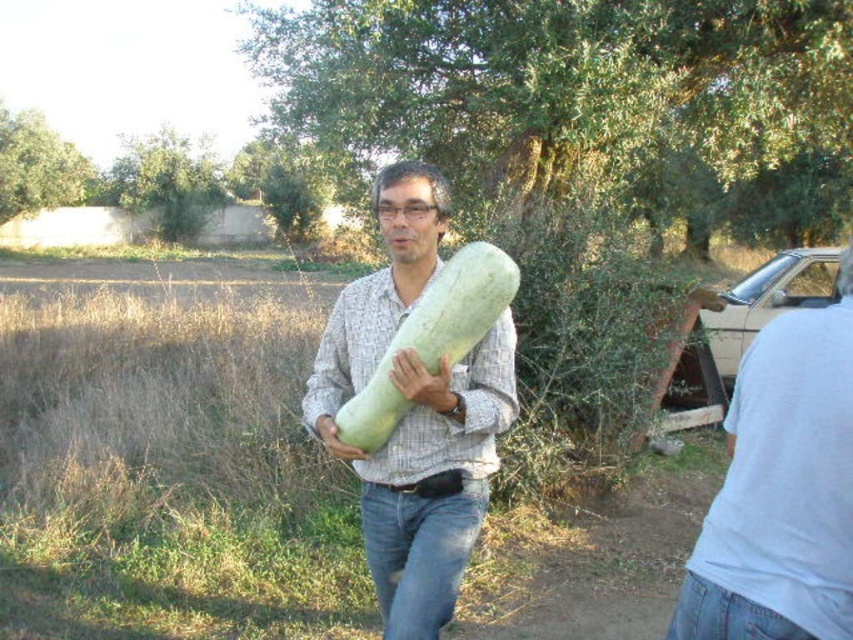
Which is behind, point (809, 292) or point (401, 387)?

The point (809, 292) is more distant.

Where is `beige metallic car at right`? This screenshot has height=640, width=853. beige metallic car at right is located at coordinates [769, 300].

Is point (751, 336) positioned after point (398, 385)?

That is True.

Find the location of a particular element. beige metallic car at right is located at coordinates (769, 300).

Is beige metallic car at right behind smooth green squash at center?

Yes.

From the picture: Is beige metallic car at right to the right of smooth green squash at center from the viewer's perspective?

Correct, you'll find beige metallic car at right to the right of smooth green squash at center.

I want to click on beige metallic car at right, so click(769, 300).

Locate an element on the screen. The image size is (853, 640). beige metallic car at right is located at coordinates (769, 300).

Is white matte shirt at right wider than smooth green squash at center?

Yes, white matte shirt at right is wider than smooth green squash at center.

Is point (770, 339) farther from viewer compared to point (343, 444)?

No.

The image size is (853, 640). I want to click on white matte shirt at right, so click(x=781, y=490).